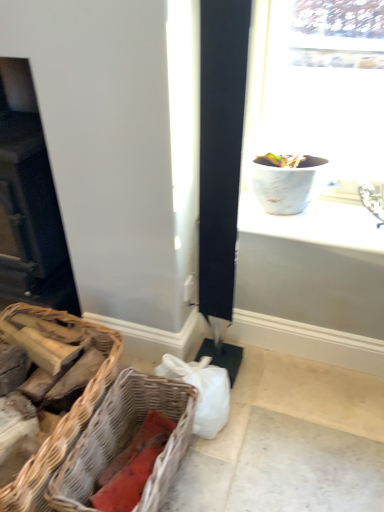
What are the coordinates of `woven wood picnic basket at lower left, the first picnic basket viewed from the right` in the screenshot? It's located at (126, 440).

I want to click on woven wood picnic basket at lower left, the first picnic basket viewed from the right, so click(126, 440).

Which is in front, brown wicker picnic basket at lower left, the first picnic basket when ordered from left to right, or matte black fireplace at left?

brown wicker picnic basket at lower left, the first picnic basket when ordered from left to right, is more forward.

Is point (103, 388) closer or farther from the camera than point (12, 239)?

Point (103, 388).

Based on their sizes in the image, would you say brown wicker picnic basket at lower left, the first picnic basket when ordered from left to right, is bigger or smaller than matte black fireplace at left?

In the image, brown wicker picnic basket at lower left, the first picnic basket when ordered from left to right, appears to be smaller than matte black fireplace at left.

Between point (51, 492) and point (95, 399), which one is positioned in front?

The point (51, 492) is closer.

Is woven wood picnic basket at lower left, the 2th picnic basket in the left-to-right sequence, surrounding brown wicker picnic basket at lower left, the 2th picnic basket when ordered from right to left?

No, woven wood picnic basket at lower left, the 2th picnic basket in the left-to-right sequence, does not contain brown wicker picnic basket at lower left, the 2th picnic basket when ordered from right to left.

Which is more to the left, woven wood picnic basket at lower left, the 2th picnic basket in the left-to-right sequence, or brown wicker picnic basket at lower left, the first picnic basket when ordered from left to right?

brown wicker picnic basket at lower left, the first picnic basket when ordered from left to right.

From a real-world perspective, does woven wood picnic basket at lower left, the first picnic basket viewed from the right, stand above brown wicker picnic basket at lower left, the first picnic basket when ordered from left to right?

No, from a real-world perspective, woven wood picnic basket at lower left, the first picnic basket viewed from the right, is not on top of brown wicker picnic basket at lower left, the first picnic basket when ordered from left to right.

Is woven wood picnic basket at lower left, the 2th picnic basket in the left-to-right sequence, wider than matte black fireplace at left?

Correct, the width of woven wood picnic basket at lower left, the 2th picnic basket in the left-to-right sequence, exceeds that of matte black fireplace at left.

Considering the relative positions of woven wood picnic basket at lower left, the first picnic basket viewed from the right, and matte black fireplace at left in the image provided, is woven wood picnic basket at lower left, the first picnic basket viewed from the right, to the left of matte black fireplace at left from the viewer's perspective?

Incorrect, woven wood picnic basket at lower left, the first picnic basket viewed from the right, is not on the left side of matte black fireplace at left.

Is woven wood picnic basket at lower left, the first picnic basket viewed from the right, bigger or smaller than matte black fireplace at left?

Clearly, woven wood picnic basket at lower left, the first picnic basket viewed from the right, is smaller in size than matte black fireplace at left.

Is brown wicker picnic basket at lower left, the 2th picnic basket when ordered from right to left, to the left of white textured vase at upper right from the viewer's perspective?

Correct, you'll find brown wicker picnic basket at lower left, the 2th picnic basket when ordered from right to left, to the left of white textured vase at upper right.

Based on the photo, how different are the orientations of brown wicker picnic basket at lower left, the 2th picnic basket when ordered from right to left, and white textured vase at upper right in degrees?

The angular difference between brown wicker picnic basket at lower left, the 2th picnic basket when ordered from right to left, and white textured vase at upper right is 0.208 degrees.

Is brown wicker picnic basket at lower left, the 2th picnic basket when ordered from right to left, oriented towards white textured vase at upper right?

No, brown wicker picnic basket at lower left, the 2th picnic basket when ordered from right to left, is not aimed at white textured vase at upper right.

Who is taller, brown wicker picnic basket at lower left, the 2th picnic basket when ordered from right to left, or white textured vase at upper right?

brown wicker picnic basket at lower left, the 2th picnic basket when ordered from right to left.

Between white textured vase at upper right and woven wood picnic basket at lower left, the first picnic basket viewed from the right, which one is positioned behind?

white textured vase at upper right is further away from the camera.

Can you confirm if white textured vase at upper right is shorter than woven wood picnic basket at lower left, the 2th picnic basket in the left-to-right sequence?

Yes.

Is white textured vase at upper right inside or outside of woven wood picnic basket at lower left, the 2th picnic basket in the left-to-right sequence?

white textured vase at upper right lies outside woven wood picnic basket at lower left, the 2th picnic basket in the left-to-right sequence.

Based on their sizes in the image, would you say brown wicker picnic basket at lower left, the first picnic basket when ordered from left to right, is bigger or smaller than woven wood picnic basket at lower left, the 2th picnic basket in the left-to-right sequence?

Considering their sizes, brown wicker picnic basket at lower left, the first picnic basket when ordered from left to right, takes up more space than woven wood picnic basket at lower left, the 2th picnic basket in the left-to-right sequence.

Are brown wicker picnic basket at lower left, the first picnic basket when ordered from left to right, and woven wood picnic basket at lower left, the 2th picnic basket in the left-to-right sequence, making contact?

No, brown wicker picnic basket at lower left, the first picnic basket when ordered from left to right, is not making contact with woven wood picnic basket at lower left, the 2th picnic basket in the left-to-right sequence.

Consider the image. Considering the relative sizes of brown wicker picnic basket at lower left, the first picnic basket when ordered from left to right, and woven wood picnic basket at lower left, the 2th picnic basket in the left-to-right sequence, in the image provided, is brown wicker picnic basket at lower left, the first picnic basket when ordered from left to right, thinner than woven wood picnic basket at lower left, the 2th picnic basket in the left-to-right sequence,?

No, brown wicker picnic basket at lower left, the first picnic basket when ordered from left to right, is not thinner than woven wood picnic basket at lower left, the 2th picnic basket in the left-to-right sequence.

Relative to woven wood picnic basket at lower left, the first picnic basket viewed from the right, is brown wicker picnic basket at lower left, the first picnic basket when ordered from left to right, in front or behind?

brown wicker picnic basket at lower left, the first picnic basket when ordered from left to right, is in front of woven wood picnic basket at lower left, the first picnic basket viewed from the right.

Can you confirm if matte black fireplace at left is thinner than brown wicker picnic basket at lower left, the 2th picnic basket when ordered from right to left?

Yes, matte black fireplace at left is thinner than brown wicker picnic basket at lower left, the 2th picnic basket when ordered from right to left.

Is matte black fireplace at left positioned behind brown wicker picnic basket at lower left, the 2th picnic basket when ordered from right to left?

Yes.

From the image's perspective, which picnic basket is the 1st one below the matte black fireplace at left? Please provide its 2D coordinates.

[(66, 413)]

Which is in front, point (46, 282) or point (40, 490)?

The point (40, 490) is closer to the camera.

Find the location of a particular element. The image size is (384, 512). fireplace that is above the brown wicker picnic basket at lower left, the first picnic basket when ordered from left to right (from a real-world perspective) is located at coordinates (29, 203).

Locate an element on the screen. The height and width of the screenshot is (512, 384). picnic basket lying behind the brown wicker picnic basket at lower left, the first picnic basket when ordered from left to right is located at coordinates (126, 440).

Estimate the real-world distances between objects in this image. Which object is closer to white textured vase at upper right, woven wood picnic basket at lower left, the 2th picnic basket in the left-to-right sequence, or brown wicker picnic basket at lower left, the 2th picnic basket when ordered from right to left?

woven wood picnic basket at lower left, the 2th picnic basket in the left-to-right sequence, is closer to white textured vase at upper right.

Which object lies nearer to the anchor point white textured vase at upper right, brown wicker picnic basket at lower left, the 2th picnic basket when ordered from right to left, or woven wood picnic basket at lower left, the 2th picnic basket in the left-to-right sequence?

Based on the image, woven wood picnic basket at lower left, the 2th picnic basket in the left-to-right sequence, appears to be nearer to white textured vase at upper right.

From the image, which object appears to be nearer to brown wicker picnic basket at lower left, the 2th picnic basket when ordered from right to left, white textured vase at upper right or matte black fireplace at left?

matte black fireplace at left lies closer to brown wicker picnic basket at lower left, the 2th picnic basket when ordered from right to left, than the other object.

Which object lies nearer to the anchor point brown wicker picnic basket at lower left, the 2th picnic basket when ordered from right to left, matte black fireplace at left or white textured vase at upper right?

matte black fireplace at left is closer to brown wicker picnic basket at lower left, the 2th picnic basket when ordered from right to left.

Looking at the image, which one is located further to matte black fireplace at left, woven wood picnic basket at lower left, the 2th picnic basket in the left-to-right sequence, or white textured vase at upper right?

Among the two, white textured vase at upper right is located further to matte black fireplace at left.

Which object lies further to the anchor point matte black fireplace at left, brown wicker picnic basket at lower left, the first picnic basket when ordered from left to right, or woven wood picnic basket at lower left, the first picnic basket viewed from the right?

woven wood picnic basket at lower left, the first picnic basket viewed from the right, is positioned further to the anchor matte black fireplace at left.

Considering their positions, is white textured vase at upper right positioned closer to matte black fireplace at left than woven wood picnic basket at lower left, the first picnic basket viewed from the right?

woven wood picnic basket at lower left, the first picnic basket viewed from the right, is closer to matte black fireplace at left.

Considering their positions, is woven wood picnic basket at lower left, the first picnic basket viewed from the right, positioned further to matte black fireplace at left than brown wicker picnic basket at lower left, the first picnic basket when ordered from left to right?

woven wood picnic basket at lower left, the first picnic basket viewed from the right.

This screenshot has width=384, height=512. What are the coordinates of `picnic basket between brown wicker picnic basket at lower left, the first picnic basket when ordered from left to right, and white textured vase at upper right, in the horizontal direction` in the screenshot? It's located at (126, 440).

You are a GUI agent. You are given a task and a screenshot of the screen. Output one action in this format:
    pyautogui.click(x=<x>, y=<y>)
    Task: Click on the picnic basket between matte black fireplace at left and woven wood picnic basket at lower left, the first picnic basket viewed from the right, vertically
    This screenshot has width=384, height=512.
    Given the screenshot: What is the action you would take?
    pyautogui.click(x=66, y=413)